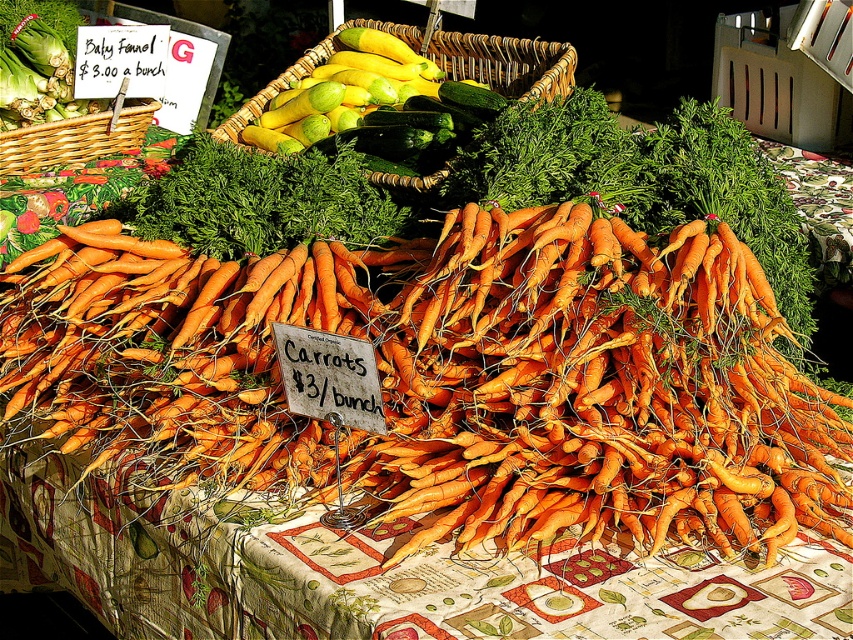
From the picture: Does green leafy at center have a lesser width compared to woven wicker basket at upper center?

Correct, green leafy at center's width is less than woven wicker basket at upper center's.

Which of these two, green leafy at center or woven wicker basket at upper center, stands shorter?

green leafy at center is shorter.

Find the location of a particular element. The width and height of the screenshot is (853, 640). green leafy at center is located at coordinates (258, 200).

Find the location of a particular element. green leafy at center is located at coordinates [x=258, y=200].

Is green leafy at center smaller than green leafy fennel at upper left?

No.

Who is higher up, green leafy at center or green leafy fennel at upper left?

green leafy fennel at upper left

Between point (305, 172) and point (67, 97), which one is positioned behind?

The point (67, 97) is more distant.

This screenshot has width=853, height=640. I want to click on green leafy at center, so click(258, 200).

Is the position of green leafy fennel at upper left more distant than that of woven brown basket at left?

Yes, it is.

Locate an element on the screen. green leafy fennel at upper left is located at coordinates (33, 70).

Does point (33, 100) come closer to viewer compared to point (1, 172)?

No, it is not.

Identify the location of green leafy fennel at upper left. (33, 70).